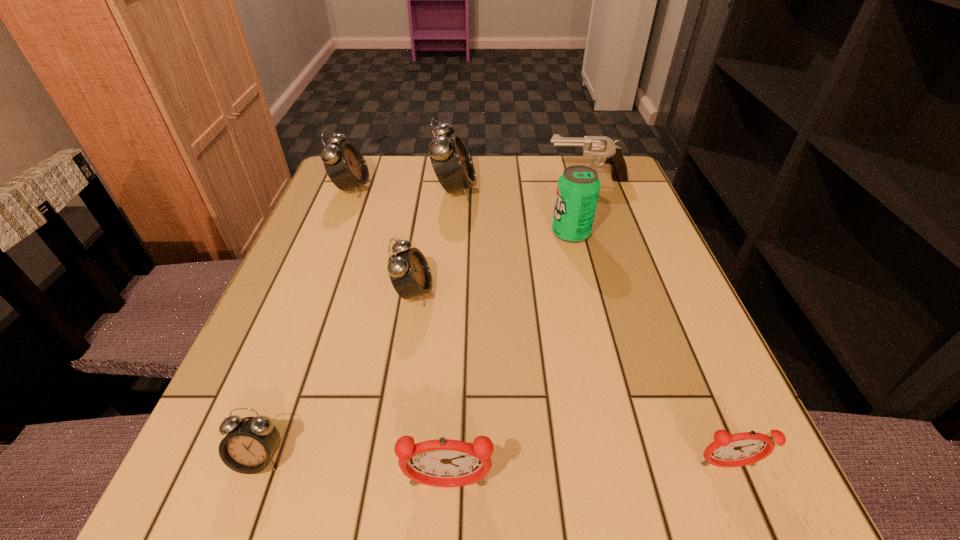
In the image, there is a desktop. What are the coordinates of `vacant space at the near edge` in the screenshot? It's located at (556, 480).

The height and width of the screenshot is (540, 960). In order to click on free space at the left edge in this screenshot , I will do `click(275, 294)`.

Identify the location of vacant region at the right edge of the desktop. (651, 249).

In the image, there is a desktop. Identify the location of vacant space at the far left corner. (371, 171).

This screenshot has width=960, height=540. What are the coordinates of `free space at the far right corner of the desktop` in the screenshot? It's located at (603, 176).

Where is `free space at the near right corner`? free space at the near right corner is located at coordinates (708, 524).

Locate an element on the screen. The width and height of the screenshot is (960, 540). free space between the tallest object and the fifth shortest alarm clock is located at coordinates (403, 189).

What are the coordinates of `empty space between the farther reddish-pink alarm clock and the left reddish-pink alarm clock` in the screenshot? It's located at tap(588, 475).

At what (x,y) coordinates should I click in order to perform the action: click on vacant space that is in between the second smallest white alarm clock and the gun. Please return your answer as a coordinate pair (x, y). Image resolution: width=960 pixels, height=540 pixels. Looking at the image, I should click on (500, 236).

Locate an element on the screen. Image resolution: width=960 pixels, height=540 pixels. vacant point located between the third farthest alarm clock and the nearer reddish-pink alarm clock is located at coordinates (431, 389).